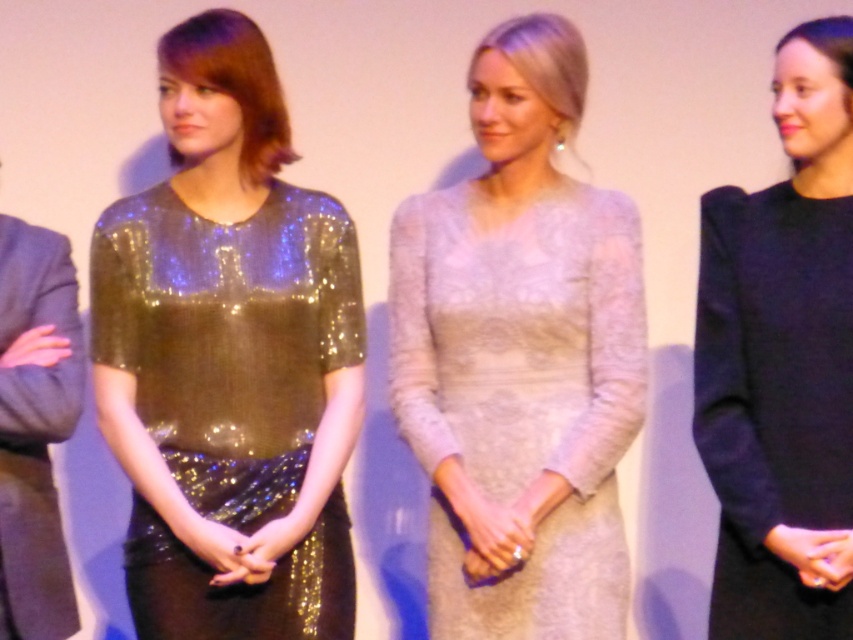
Who is taller, lace dress at center or black matte dress at right?

lace dress at center

Can you confirm if lace dress at center is thinner than black matte dress at right?

Incorrect, lace dress at center's width is not less than black matte dress at right's.

Which is in front, point (457, 435) or point (804, 44)?

Point (804, 44) is more forward.

At what (x,y) coordinates should I click in order to perform the action: click on lace dress at center. Please return your answer as a coordinate pair (x, y). This screenshot has width=853, height=640. Looking at the image, I should click on (520, 356).

Does shiny sequined dress at center have a lesser width compared to black matte dress at right?

No.

Between point (253, 588) and point (845, 545), which one is positioned in front?

Point (845, 545) is in front.

Locate an element on the screen. shiny sequined dress at center is located at coordinates (229, 358).

Does shiny sequined dress at center lie in front of lace dress at center?

Yes.

Is shiny sequined dress at center bigger than lace dress at center?

No.

This screenshot has width=853, height=640. What do you see at coordinates (229, 358) in the screenshot?
I see `shiny sequined dress at center` at bounding box center [229, 358].

You are a GUI agent. You are given a task and a screenshot of the screen. Output one action in this format:
    pyautogui.click(x=<x>, y=<y>)
    Task: Click on the shiny sequined dress at center
    
    Given the screenshot: What is the action you would take?
    pyautogui.click(x=229, y=358)